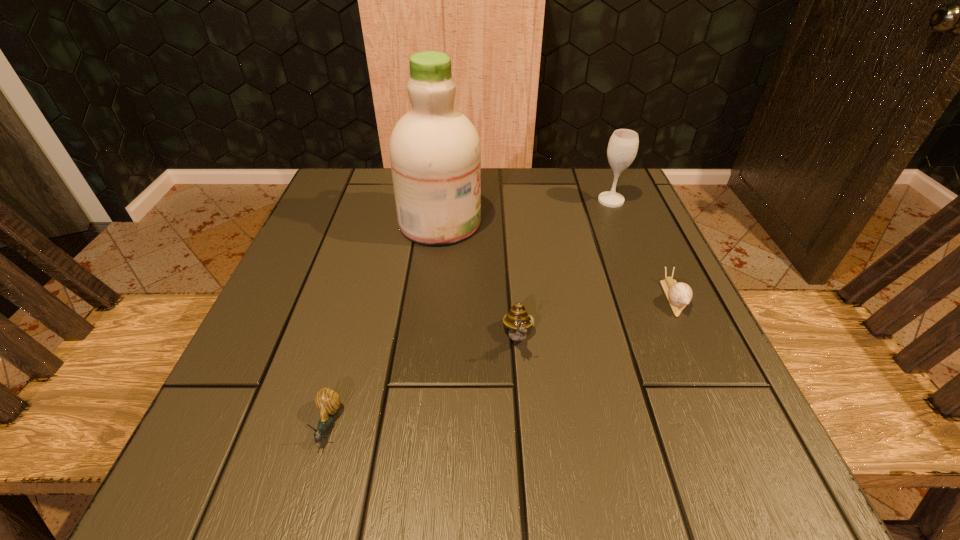
I want to click on object at the far right corner, so click(623, 145).

In the image, there is a desktop. Where is `vacant space at the far edge`? vacant space at the far edge is located at coordinates (536, 184).

Where is `free space at the near edge of the desktop`? The height and width of the screenshot is (540, 960). free space at the near edge of the desktop is located at coordinates (404, 460).

This screenshot has height=540, width=960. In the image, there is a desktop. In order to click on free space at the left edge in this screenshot , I will do `click(331, 234)`.

The image size is (960, 540). I want to click on free space at the right edge, so click(610, 267).

Identify the location of vacant space at the far left corner of the desktop. This screenshot has width=960, height=540. (354, 197).

At what (x,y) coordinates should I click in order to perform the action: click on free region at the near left corner of the desktop. Please return your answer as a coordinate pair (x, y). Looking at the image, I should click on (207, 441).

The image size is (960, 540). In the image, there is a desktop. Find the location of `vacant area at the far right corner`. vacant area at the far right corner is located at coordinates (604, 211).

The height and width of the screenshot is (540, 960). I want to click on vacant region at the near right corner of the desktop, so click(720, 449).

Where is `vacant region between the wineglass and the second escargot from right to left`? This screenshot has height=540, width=960. vacant region between the wineglass and the second escargot from right to left is located at coordinates (564, 269).